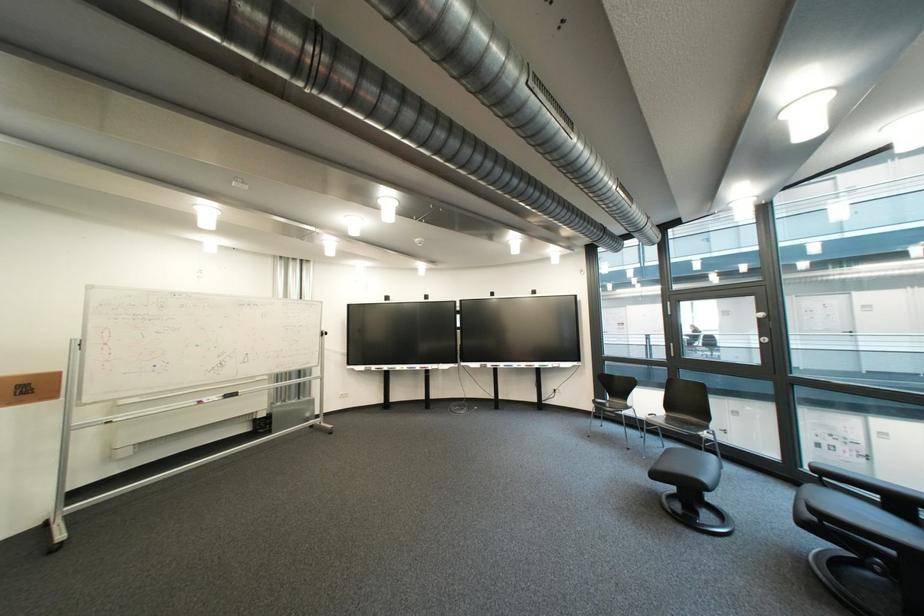
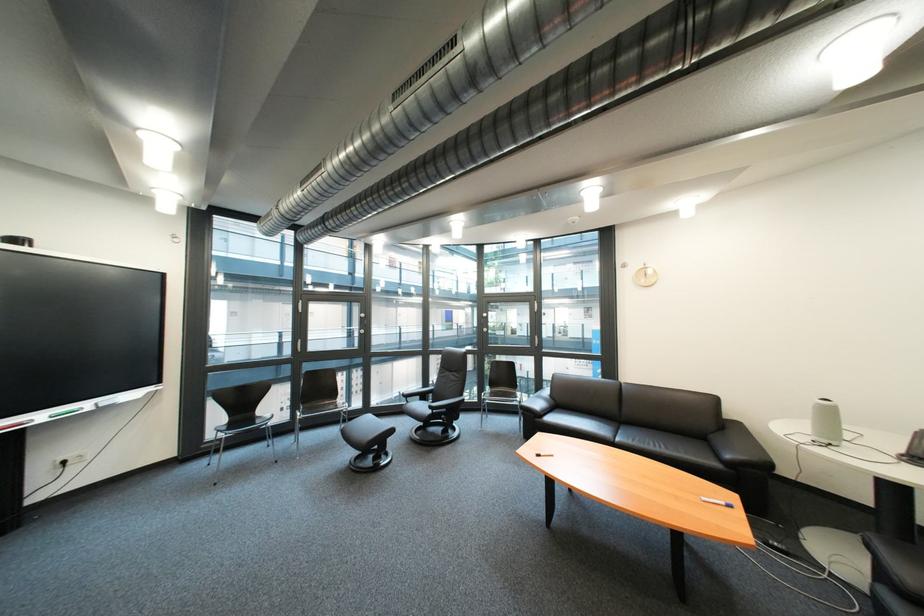
Find the pixel in the second image that matches [564,366] in the first image.

(101, 406)